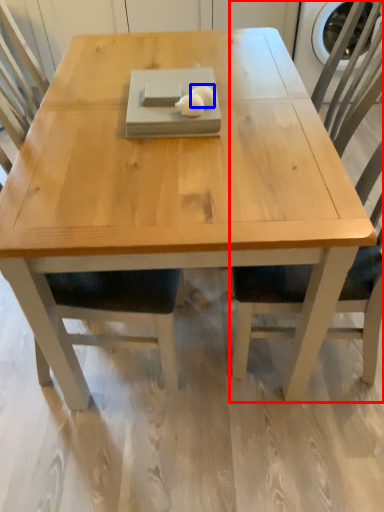
Question: Which object appears closest to the camera in this image, chair (highlighted by a red box) or food (highlighted by a blue box)?

Choices:
 (A) chair
 (B) food

Answer: (A)